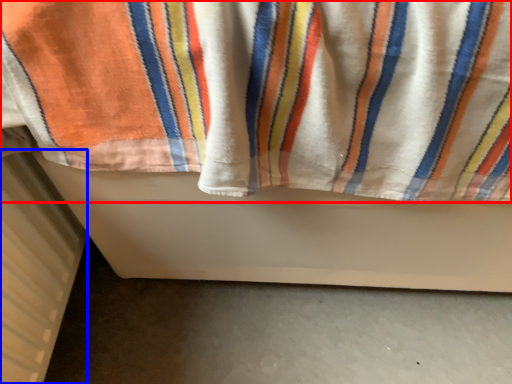
Question: Which of the following is the farthest to the observer, towel (highlighted by a red box) or radiator (highlighted by a blue box)?

Choices:
 (A) towel
 (B) radiator

Answer: (B)